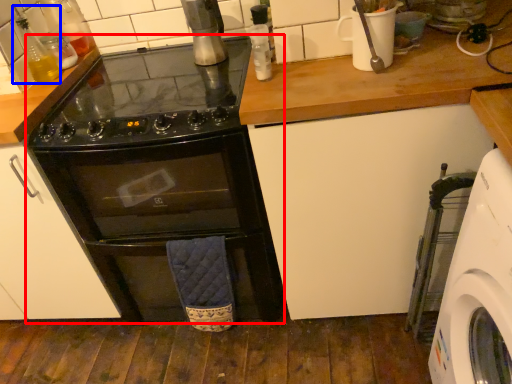
Question: Among these objects, which one is nearest to the camera, oven (highlighted by a red box) or bottle (highlighted by a blue box)?

Choices:
 (A) oven
 (B) bottle

Answer: (A)